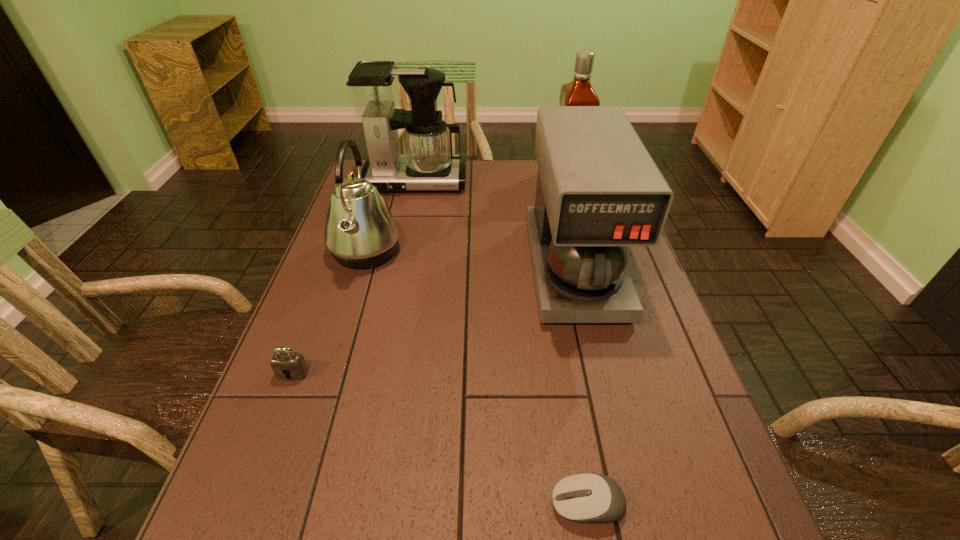
Where is `coffee maker that is at the left edge`? coffee maker that is at the left edge is located at coordinates (428, 164).

The height and width of the screenshot is (540, 960). Identify the location of kettle situated at the left edge. (360, 231).

The height and width of the screenshot is (540, 960). In order to click on padlock located at the left edge in this screenshot , I will do `click(287, 365)`.

Locate an element on the screen. liquor that is at the right edge is located at coordinates (x=579, y=92).

Find the location of a particular element. The width and height of the screenshot is (960, 540). coffee maker that is at the right edge is located at coordinates (598, 191).

At what (x,y) coordinates should I click in order to perform the action: click on object that is at the far left corner. Please return your answer as a coordinate pair (x, y). Looking at the image, I should click on (428, 164).

Where is `object that is at the far right corner`? object that is at the far right corner is located at coordinates (579, 92).

Image resolution: width=960 pixels, height=540 pixels. What are the coordinates of `free space at the far edge of the desktop` in the screenshot? It's located at (511, 174).

This screenshot has height=540, width=960. Find the location of `blank space at the left edge of the desktop`. blank space at the left edge of the desktop is located at coordinates (277, 479).

Identify the location of blank space at the right edge. (667, 388).